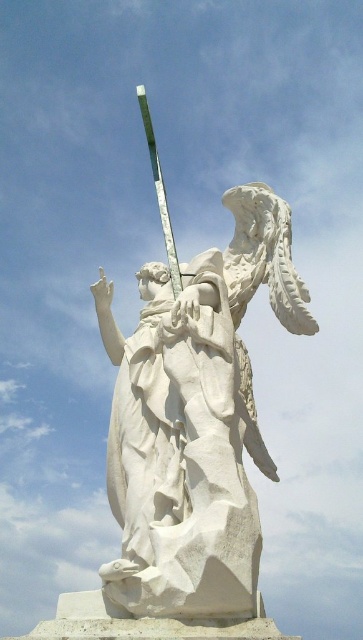
You are an art student analyzing the sculpture and its elements. You notice the white marble statue at center and the green glass pole at upper center. Which object is larger in size?

The white marble statue at center has a smaller size compared to green glass pole at upper center, so the green glass pole at upper center is larger.

You are standing in front of a classical sculpture. The sculpture has two figures, one human on the left and an eagle on the right. The human figure is pointing upwards with its right hand. Now, you want to take a photo of the white marble statue at center located at point [194,420]. Where should you aim your camera to capture the white marble statue at center?

You should aim your camera at point [194,420] to capture the white marble statue at center as described in the scene.

From the picture: You are an art conservator assessing the dimensions of the white marble statue at center and the green glass pole at upper center. Which object has a greater width?

The white marble statue at center has a greater width than the green glass pole at upper center.